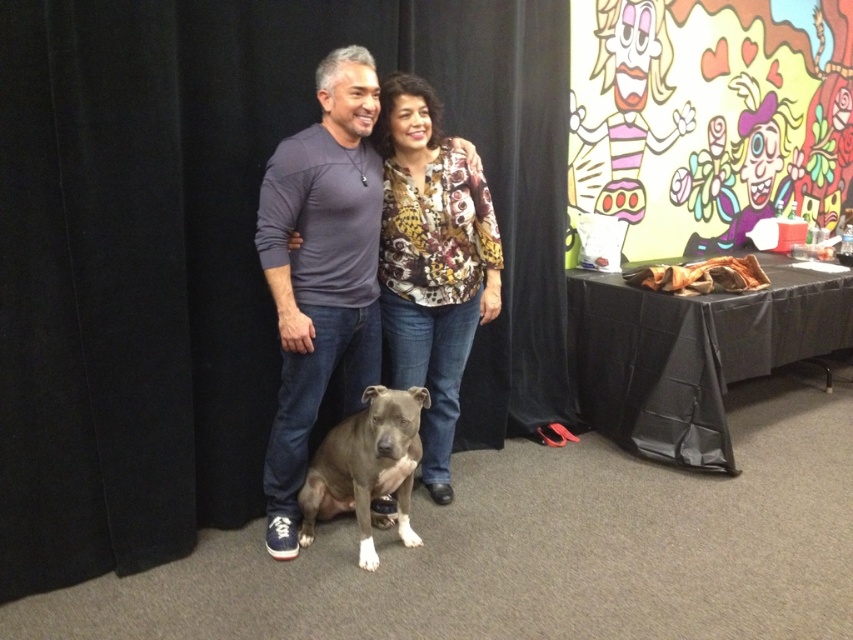
Which of these two, printed fabric blouse at center or gray matte dog at lower center, stands shorter?

gray matte dog at lower center

Does printed fabric blouse at center appear on the right side of gray matte dog at lower center?

Yes, printed fabric blouse at center is to the right of gray matte dog at lower center.

Is point (445, 269) closer to camera compared to point (305, 515)?

No, (445, 269) is behind (305, 515).

The image size is (853, 640). I want to click on printed fabric blouse at center, so click(431, 262).

Can you confirm if matte gray dog at center is positioned above gray matte dog at lower center?

Correct, matte gray dog at center is located above gray matte dog at lower center.

Can you confirm if matte gray dog at center is shorter than gray matte dog at lower center?

In fact, matte gray dog at center may be taller than gray matte dog at lower center.

Between point (281, 420) and point (357, 444), which one is positioned behind?

The point (281, 420) is more distant.

The height and width of the screenshot is (640, 853). Find the location of `matte gray dog at center`. matte gray dog at center is located at coordinates [320, 272].

Can you confirm if matte gray dog at center is shorter than printed fabric blouse at center?

No.

Is matte gray dog at center above printed fabric blouse at center?

No.

The height and width of the screenshot is (640, 853). Find the location of `matte gray dog at center`. matte gray dog at center is located at coordinates (320, 272).

Locate an element on the screen. matte gray dog at center is located at coordinates (320, 272).